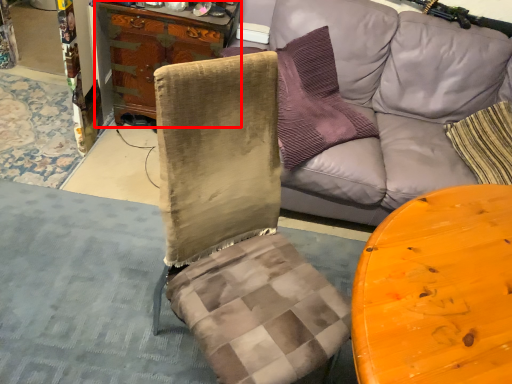
Question: Observing the image, what is the correct spatial positioning of cabinetry (annotated by the red box) in reference to studio couch?

Choices:
 (A) right
 (B) left

Answer: (B)